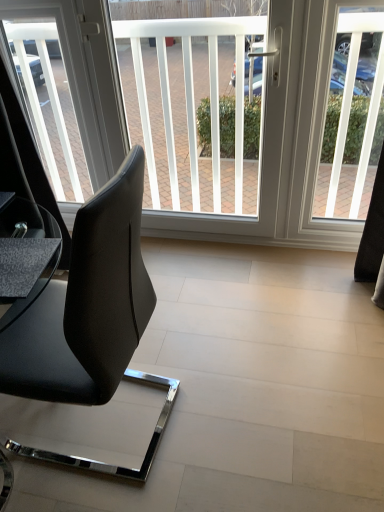
In order to click on black leather chair at left in this screenshot , I will do `click(90, 320)`.

Where is `matte black table at lower left`? This screenshot has height=512, width=384. matte black table at lower left is located at coordinates (25, 271).

Is white plastic window screen at center, the 2th window screen in the left-to-right sequence, aimed at white plastic window screen at upper right, the 3th window screen viewed from the left?

No, white plastic window screen at center, the 2th window screen in the left-to-right sequence, is not facing towards white plastic window screen at upper right, the 3th window screen viewed from the left.

From the image's perspective, is white plastic window screen at center, which is counted as the 2th window screen, starting from the right, located above or below white plastic window screen at upper right, the 3th window screen viewed from the left?

white plastic window screen at center, which is counted as the 2th window screen, starting from the right, is above white plastic window screen at upper right, the 3th window screen viewed from the left.

Considering the relative positions of white plastic window screen at center, the 2th window screen in the left-to-right sequence, and white plastic window screen at upper right, the 3th window screen viewed from the left, in the image provided, is white plastic window screen at center, the 2th window screen in the left-to-right sequence, behind white plastic window screen at upper right, the 3th window screen viewed from the left,?

No, white plastic window screen at center, the 2th window screen in the left-to-right sequence, is closer to the viewer.

Is white plastic window screen at center, which is counted as the 2th window screen, starting from the right, with matte black table at lower left?

No, white plastic window screen at center, which is counted as the 2th window screen, starting from the right, is not next to matte black table at lower left.

Is white plastic window screen at center, which is counted as the 2th window screen, starting from the right, wider or thinner than matte black table at lower left?

Clearly, white plastic window screen at center, which is counted as the 2th window screen, starting from the right, has less width compared to matte black table at lower left.

Is point (206, 187) positioned before point (6, 257)?

No, (206, 187) is behind (6, 257).

Is white plastic window screen at center, which is counted as the 2th window screen, starting from the right, at the left side of matte black table at lower left?

No.

Considering the sizes of objects matte black table at lower left and white plastic window screen at upper right, which is the first window screen from right to left, in the image provided, who is shorter, matte black table at lower left or white plastic window screen at upper right, which is the first window screen from right to left,?

matte black table at lower left.

Is matte black table at lower left behind white plastic window screen at upper right, which is the first window screen from right to left?

No, matte black table at lower left is closer to the camera.

From a real-world perspective, which object stands above the other?

From a 3D spatial view, matte black table at lower left is above.

How much distance is there between matte black table at lower left and white plastic window screen at upper right, the 3th window screen viewed from the left?

matte black table at lower left is 1.58 meters from white plastic window screen at upper right, the 3th window screen viewed from the left.

Which object is closer to the camera, black leather chair at left or matte black table at lower left?

black leather chair at left is closer to the camera.

Can matte black table at lower left be found inside black leather chair at left?

That's correct, matte black table at lower left is inside black leather chair at left.

Is black leather chair at left looking in the opposite direction of matte black table at lower left?

Yes, black leather chair at left is positioned with its back facing matte black table at lower left.

From the image's perspective, would you say black leather chair at left is shown under matte black table at lower left?

Yes, from the image's perspective, black leather chair at left is below matte black table at lower left.

Is there a large distance between matte black table at lower left and white plastic window screen at center, which is counted as the 2th window screen, starting from the right?

Yes, matte black table at lower left is far from white plastic window screen at center, which is counted as the 2th window screen, starting from the right.

From the image's perspective, between matte black table at lower left and white plastic window screen at center, which is counted as the 2th window screen, starting from the right, which one is located above?

white plastic window screen at center, which is counted as the 2th window screen, starting from the right, appears higher in the image.

Between matte black table at lower left and white plastic window screen at center, the 2th window screen in the left-to-right sequence, which one appears on the left side from the viewer's perspective?

matte black table at lower left.

Who is smaller, transparent glass window screen at upper left, which is the third window screen from right to left, or white plastic window screen at center, the 2th window screen in the left-to-right sequence?

Smaller between the two is transparent glass window screen at upper left, which is the third window screen from right to left.

From a real-world perspective, is transparent glass window screen at upper left, which is the third window screen from right to left, positioned over white plastic window screen at center, the 2th window screen in the left-to-right sequence, based on gravity?

Yes, from a real-world perspective, transparent glass window screen at upper left, which is the third window screen from right to left, is on top of white plastic window screen at center, the 2th window screen in the left-to-right sequence.

Is there a large distance between transparent glass window screen at upper left, placed as the first window screen when sorted from left to right, and white plastic window screen at center, the 2th window screen in the left-to-right sequence?

transparent glass window screen at upper left, placed as the first window screen when sorted from left to right, is near white plastic window screen at center, the 2th window screen in the left-to-right sequence, not far away.

Does point (60, 159) appear closer or farther from the camera than point (213, 166)?

Point (60, 159) is farther from the camera than point (213, 166).

Does white plastic window screen at upper right, which is the first window screen from right to left, turn towards transparent glass window screen at upper left, which is the third window screen from right to left?

No.

Which of these two, white plastic window screen at upper right, which is the first window screen from right to left, or transparent glass window screen at upper left, which is the third window screen from right to left, is thinner?

Thinner between the two is transparent glass window screen at upper left, which is the third window screen from right to left.

Find the location of `the 2nd window screen counting from the left of the white plastic window screen at upper right, which is the first window screen from right to left`. the 2nd window screen counting from the left of the white plastic window screen at upper right, which is the first window screen from right to left is located at coordinates (49, 103).

Is white plastic window screen at upper right, which is the first window screen from right to left, placed right next to transparent glass window screen at upper left, placed as the first window screen when sorted from left to right?

No, white plastic window screen at upper right, which is the first window screen from right to left, is not touching transparent glass window screen at upper left, placed as the first window screen when sorted from left to right.

The height and width of the screenshot is (512, 384). I want to click on the 1st window screen to the left of the white plastic window screen at upper right, which is the first window screen from right to left, counting from the anchor's position, so click(195, 109).

Find the location of a particular element. This screenshot has width=384, height=512. table lying below the white plastic window screen at center, which is counted as the 2th window screen, starting from the right (from the image's perspective) is located at coordinates (25, 271).

Based on their spatial positions, is white plastic window screen at upper right, which is the first window screen from right to left, or transparent glass window screen at upper left, which is the third window screen from right to left, further from white plastic window screen at center, the 2th window screen in the left-to-right sequence?

The object further to white plastic window screen at center, the 2th window screen in the left-to-right sequence, is transparent glass window screen at upper left, which is the third window screen from right to left.

From the image, which object appears to be farther from matte black table at lower left, transparent glass window screen at upper left, which is the third window screen from right to left, or white plastic window screen at center, which is counted as the 2th window screen, starting from the right?

Among the two, transparent glass window screen at upper left, which is the third window screen from right to left, is located further to matte black table at lower left.

From the image, which object appears to be farther from white plastic window screen at upper right, the 3th window screen viewed from the left, white plastic window screen at center, the 2th window screen in the left-to-right sequence, or matte black table at lower left?

matte black table at lower left lies further to white plastic window screen at upper right, the 3th window screen viewed from the left, than the other object.

Which object lies nearer to the anchor point white plastic window screen at center, which is counted as the 2th window screen, starting from the right, matte black table at lower left or black leather chair at left?

Among the two, black leather chair at left is located nearer to white plastic window screen at center, which is counted as the 2th window screen, starting from the right.

Looking at the image, which one is located further to transparent glass window screen at upper left, placed as the first window screen when sorted from left to right, white plastic window screen at upper right, the 3th window screen viewed from the left, or black leather chair at left?

The object further to transparent glass window screen at upper left, placed as the first window screen when sorted from left to right, is white plastic window screen at upper right, the 3th window screen viewed from the left.

Considering their positions, is black leather chair at left positioned further to white plastic window screen at upper right, which is the first window screen from right to left, than matte black table at lower left?

matte black table at lower left is further to white plastic window screen at upper right, which is the first window screen from right to left.

Looking at the image, which one is located further to matte black table at lower left, white plastic window screen at center, the 2th window screen in the left-to-right sequence, or white plastic window screen at upper right, the 3th window screen viewed from the left?

Based on the image, white plastic window screen at upper right, the 3th window screen viewed from the left, appears to be further to matte black table at lower left.

Looking at the image, which one is located further to matte black table at lower left, black leather chair at left or transparent glass window screen at upper left, which is the third window screen from right to left?

Among the two, transparent glass window screen at upper left, which is the third window screen from right to left, is located further to matte black table at lower left.

I want to click on chair between matte black table at lower left and white plastic window screen at upper right, which is the first window screen from right to left, from left to right, so click(90, 320).

Where is `chair between transparent glass window screen at upper left, placed as the first window screen when sorted from left to right, and white plastic window screen at upper right, the 3th window screen viewed from the left`? The width and height of the screenshot is (384, 512). chair between transparent glass window screen at upper left, placed as the first window screen when sorted from left to right, and white plastic window screen at upper right, the 3th window screen viewed from the left is located at coordinates (90, 320).

At what (x,y) coordinates should I click in order to perform the action: click on table between transparent glass window screen at upper left, placed as the first window screen when sorted from left to right, and white plastic window screen at upper right, the 3th window screen viewed from the left, from left to right. Please return your answer as a coordinate pair (x, y). The image size is (384, 512). Looking at the image, I should click on (25, 271).

The image size is (384, 512). Find the location of `table positioned between black leather chair at left and transparent glass window screen at upper left, placed as the first window screen when sorted from left to right, from near to far`. table positioned between black leather chair at left and transparent glass window screen at upper left, placed as the first window screen when sorted from left to right, from near to far is located at coordinates (25, 271).